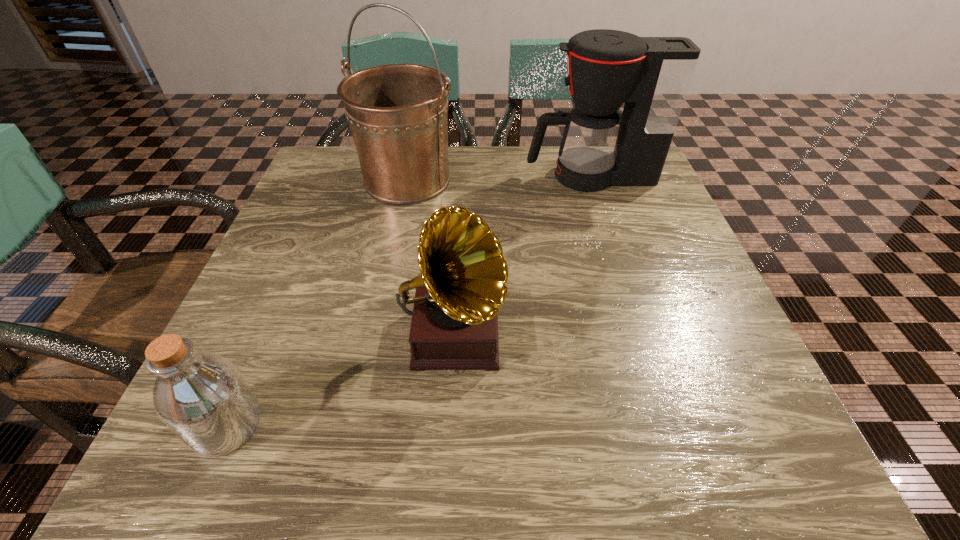
At what (x,y) coordinates should I click in order to perform the action: click on unoccupied area between the bottle and the tallest object. Please return your answer as a coordinate pair (x, y). The image size is (960, 540). Looking at the image, I should click on (318, 303).

The height and width of the screenshot is (540, 960). Identify the location of empty space that is in between the third shortest object and the third tallest object. (522, 255).

Where is `free space between the second shortest object and the shortest object`? The height and width of the screenshot is (540, 960). free space between the second shortest object and the shortest object is located at coordinates (341, 380).

Identify which object is located as the second nearest to the tallest object. Please provide its 2D coordinates. Your answer should be formatted as a tuple, i.e. [(x, y)], where the tuple contains the x and y coordinates of a point satisfying the conditions above.

[(462, 284)]

Locate an element on the screen. The height and width of the screenshot is (540, 960). object that can be found as the closest to the second tallest object is located at coordinates (397, 113).

You are a GUI agent. You are given a task and a screenshot of the screen. Output one action in this format:
    pyautogui.click(x=<x>, y=<y>)
    Task: Click on the free spot that satisfies the following two spatial constraints: 1. pour from the carafe of the coffee maker; 2. from the horn of the second shortest object
    
    Given the screenshot: What is the action you would take?
    pyautogui.click(x=641, y=334)

Image resolution: width=960 pixels, height=540 pixels. Identify the location of blank space that satisfies the following two spatial constraints: 1. pour from the carafe of the coffee maker; 2. from the horn of the phonograph record. (641, 334).